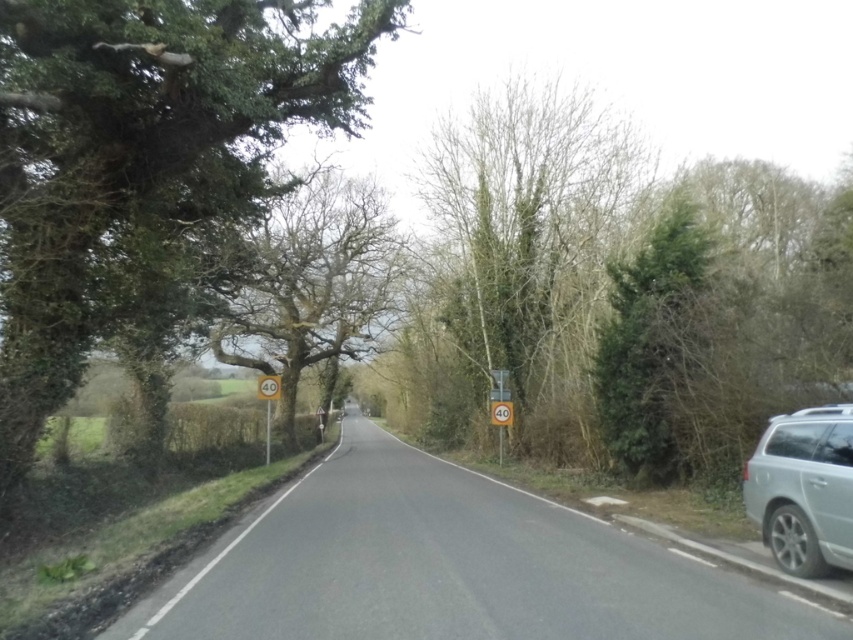
Question: Among these points, which one is farthest from the camera?

Choices:
 (A) (265, 397)
 (B) (793, 573)

Answer: (A)

Question: Does silver metallic car at right appear over yellow plastic speed limit sign at left?

Choices:
 (A) yes
 (B) no

Answer: (B)

Question: Is silver metallic car at right to the left of silver metallic minivan at right from the viewer's perspective?

Choices:
 (A) yes
 (B) no

Answer: (A)

Question: Is green leafy tree at right above yellow plastic speed limit sign at left?

Choices:
 (A) no
 (B) yes

Answer: (B)

Question: Which point is farther to the camera?

Choices:
 (A) (521, 145)
 (B) (757, 444)
 (C) (216, 637)
 (D) (643, 440)

Answer: (A)

Question: Which is nearer to the silver metallic car at right?

Choices:
 (A) yellow plastic speed limit sign at left
 (B) green leafy tree at left

Answer: (B)